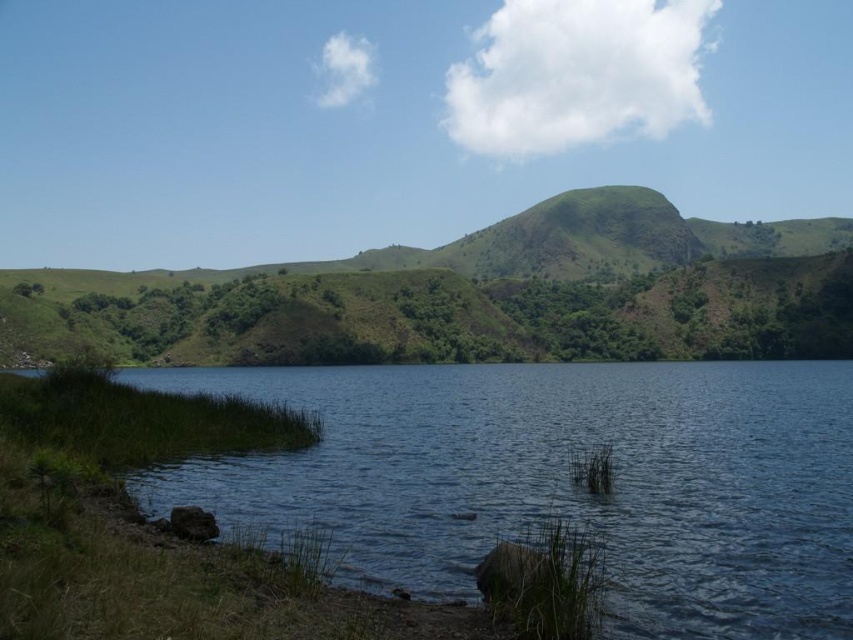
Image resolution: width=853 pixels, height=640 pixels. I want to click on clear water at lower left, so click(560, 481).

Is clear water at lower left shorter than green grassy hill at center?

Yes.

Locate an element on the screen. clear water at lower left is located at coordinates (560, 481).

You are a GUI agent. You are given a task and a screenshot of the screen. Output one action in this format:
    pyautogui.click(x=<x>, y=<y>)
    Task: Click on the clear water at lower left
    
    Given the screenshot: What is the action you would take?
    (x=560, y=481)